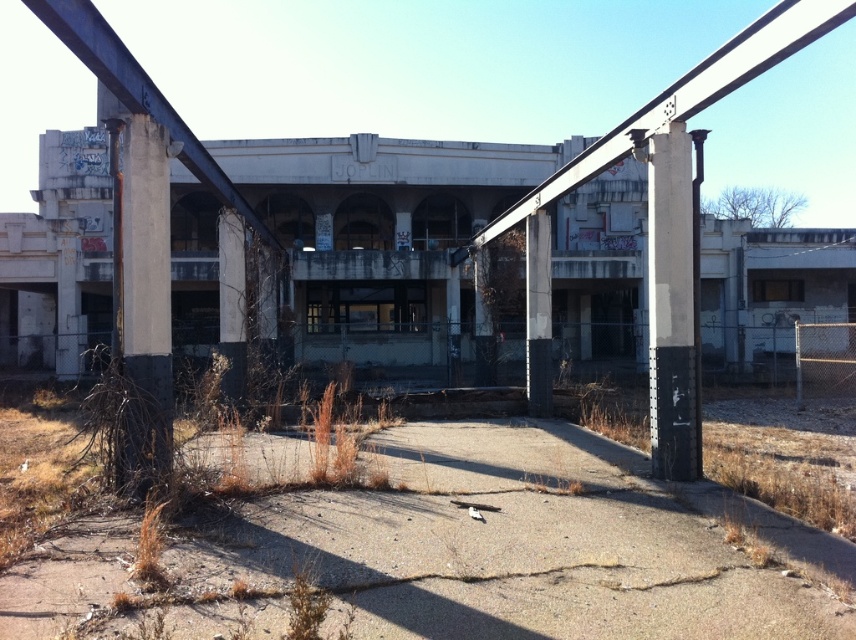
You are a construction worker standing at the entrance of the abandoned building. You need to place a safety barrier that requires a minimum of 8 meters of space between the barrier and the concrete pillar at left. Is the current distance sufficient?

The concrete pillar at left and viewer are 7.72 meters apart from each other, so the current distance of 7.72 meters is less than the required 8 meters. Therefore, the safety barrier cannot be placed as it does not meet the minimum distance requirement.

You are standing at the entrance of the abandoned building and want to locate the concrete pillar at left. According to the coordinates provided, where should you look relative to your position?

The concrete pillar at left is located at point coordinates 0.473 on the x axis and 0.171 on the y axis, so you should look towards the left side of the building near the bottom area since lower y coordinates indicate lower positions in the image.